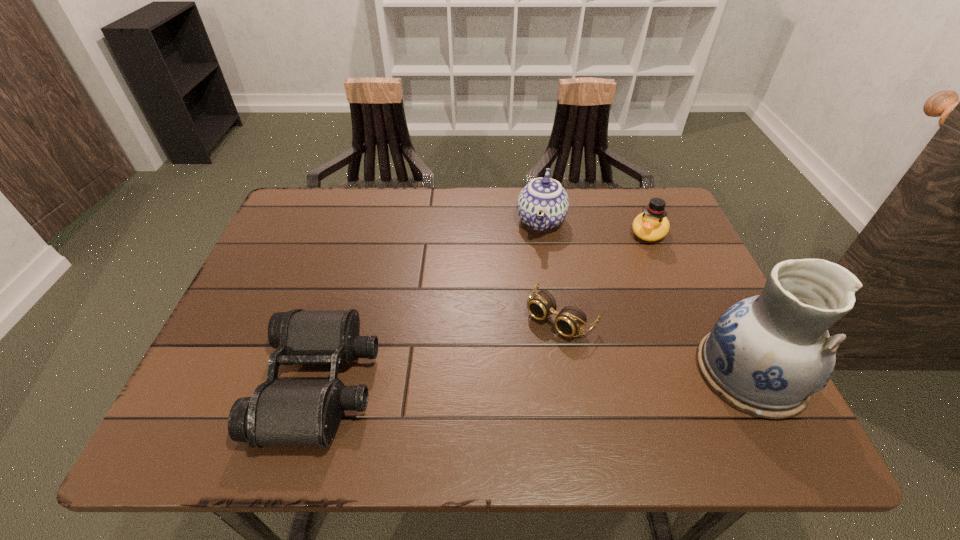
Find the location of a particular element. The image size is (960, 540). unoccupied position between the duck and the chinaware is located at coordinates (594, 227).

The image size is (960, 540). Find the location of `vacant space that is in between the duck and the goggles`. vacant space that is in between the duck and the goggles is located at coordinates (605, 275).

Select which object is the closest to the fourth tallest object. Please provide its 2D coordinates. Your answer should be formatted as a tuple, i.e. [(x, y)], where the tuple contains the x and y coordinates of a point satisfying the conditions above.

[(570, 320)]

Select which object is the third closest to the third shortest object. Please provide its 2D coordinates. Your answer should be formatted as a tuple, i.e. [(x, y)], where the tuple contains the x and y coordinates of a point satisfying the conditions above.

[(766, 355)]